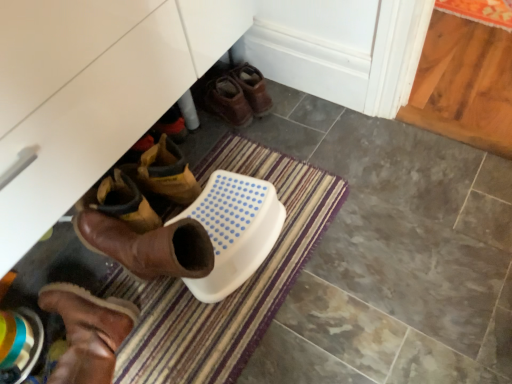
Question: Considering the relative positions of brown leather boots at center, placed as the first footwear when sorted from right to left, and brown suede boot at lower left, which is the second footwear in top-to-bottom order, in the image provided, is brown leather boots at center, placed as the first footwear when sorted from right to left, to the left of brown suede boot at lower left, which is the second footwear in top-to-bottom order, from the viewer's perspective?

Choices:
 (A) no
 (B) yes

Answer: (A)

Question: From the image's perspective, is brown leather boots at center, the 2th footwear when ordered from left to right, under brown suede boot at lower left, which is the first footwear in left-to-right order?

Choices:
 (A) yes
 (B) no

Answer: (B)

Question: Is brown leather boots at center, placed as the first footwear when sorted from right to left, closer to camera compared to brown suede boot at lower left, which is the 2th footwear in back-to-front order?

Choices:
 (A) no
 (B) yes

Answer: (A)

Question: Considering the relative sizes of brown leather boots at center, acting as the 1th footwear starting from the back, and brown suede boot at lower left, which is the 2th footwear in back-to-front order, in the image provided, is brown leather boots at center, acting as the 1th footwear starting from the back, taller than brown suede boot at lower left, which is the 2th footwear in back-to-front order,?

Choices:
 (A) yes
 (B) no

Answer: (B)

Question: Is brown leather boots at center, which is the 2th footwear in bottom-to-top order, next to brown suede boot at lower left, which is the 2th footwear in back-to-front order, and touching it?

Choices:
 (A) no
 (B) yes

Answer: (A)

Question: From the image's perspective, relative to brown suede boot at lower left, the second footwear when ordered from right to left, is brown leather boots at center, acting as the 1th footwear starting from the back, above or below?

Choices:
 (A) below
 (B) above

Answer: (B)

Question: Choose the correct answer: Is brown leather boots at center, the second footwear when ordered from front to back, inside brown suede boot at lower left, which is the first footwear in left-to-right order, or outside it?

Choices:
 (A) outside
 (B) inside

Answer: (A)

Question: In the image, is brown leather boots at center, which is the 2th footwear in bottom-to-top order, positioned in front of or behind brown suede boot at lower left, which is the first footwear in left-to-right order?

Choices:
 (A) front
 (B) behind

Answer: (B)

Question: In terms of height, does brown leather boots at center, arranged as the first footwear when viewed from the top, look taller or shorter compared to brown suede boot at lower left, the first footwear from the bottom?

Choices:
 (A) short
 (B) tall

Answer: (A)

Question: Is brown suede boot at lower left, which is the 2th footwear in back-to-front order, taller or shorter than brown leather boots at center, placed as the first footwear when sorted from right to left?

Choices:
 (A) short
 (B) tall

Answer: (B)

Question: Is point (71, 374) positioned closer to the camera than point (236, 104)?

Choices:
 (A) closer
 (B) farther

Answer: (A)

Question: Is brown suede boot at lower left, the second footwear when ordered from right to left, inside or outside of brown leather boots at center, arranged as the first footwear when viewed from the top?

Choices:
 (A) inside
 (B) outside

Answer: (B)

Question: Is brown suede boot at lower left, which is the 2th footwear in back-to-front order, wider or thinner than brown leather boots at center, the 2th footwear when ordered from left to right?

Choices:
 (A) wide
 (B) thin

Answer: (A)

Question: From their relative heights in the image, would you say brown leather boots at center, which is the 2th footwear in bottom-to-top order, is taller or shorter than striped carpet at lower center?

Choices:
 (A) tall
 (B) short

Answer: (A)

Question: Is point (205, 97) closer or farther from the camera than point (145, 370)?

Choices:
 (A) farther
 (B) closer

Answer: (A)